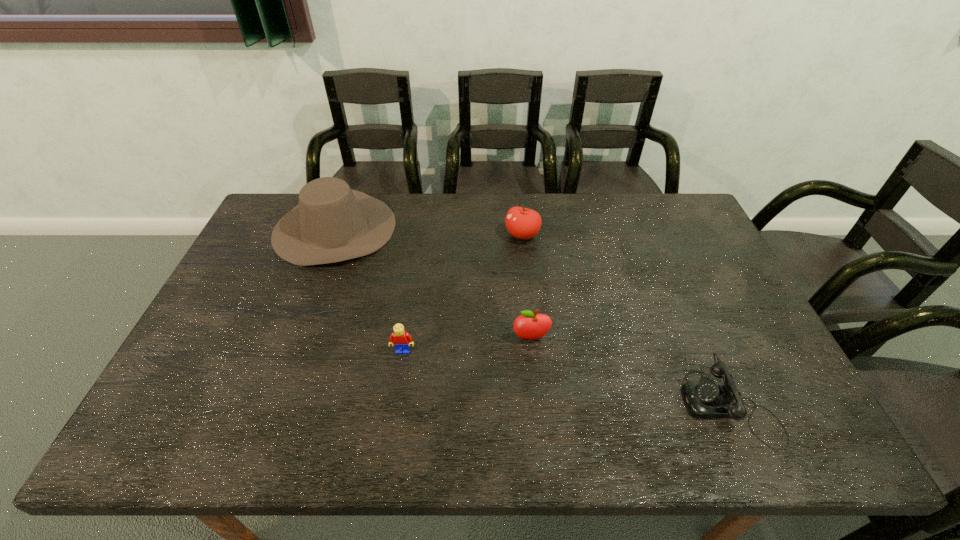
The image size is (960, 540). I want to click on the leftmost object, so click(x=332, y=223).

This screenshot has width=960, height=540. Identify the location of the tallest object. (332, 223).

Find the location of a particular element. The image size is (960, 540). the farther apple is located at coordinates (523, 223).

Identify the location of the nearer apple. (529, 325).

Where is `Lego`? Lego is located at coordinates (401, 340).

Identify the location of the fourth object from right to left. (401, 340).

Find the location of a particular element. The image size is (960, 540). the rightmost object is located at coordinates tap(707, 399).

In order to click on the nearest object in this screenshot , I will do `click(707, 399)`.

Identify the location of vacant area situated 0.340m on the front of the cowboy hat. This screenshot has height=540, width=960. (285, 363).

Where is `vacant area located 0.250m on the left of the farther apple`? This screenshot has height=540, width=960. vacant area located 0.250m on the left of the farther apple is located at coordinates (429, 235).